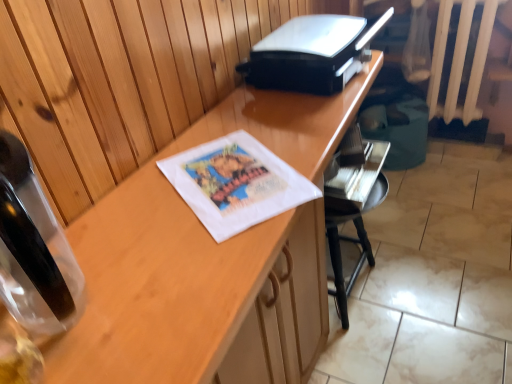
What do you see at coordinates (208, 262) in the screenshot? The width and height of the screenshot is (512, 384). I see `wooden desk at center` at bounding box center [208, 262].

I want to click on wooden desk at center, so click(208, 262).

What do you see at coordinates (312, 53) in the screenshot? The width and height of the screenshot is (512, 384). I see `black plastic printer at upper center` at bounding box center [312, 53].

Locate an element on the screen. The width and height of the screenshot is (512, 384). black plastic printer at upper center is located at coordinates (312, 53).

Locate an element on the screen. wooden desk at center is located at coordinates (208, 262).

Which object is positioned more to the right, black plastic printer at upper center or wooden desk at center?

black plastic printer at upper center.

Is the position of black plastic printer at upper center more distant than that of wooden desk at center?

Yes, it is behind wooden desk at center.

Which is farther from the camera, (294, 22) or (296, 221)?

The point (294, 22) is farther from the camera.

From the image's perspective, which one is positioned higher, black plastic printer at upper center or wooden desk at center?

black plastic printer at upper center, from the image's perspective.

From a real-world perspective, who is located lower, black plastic printer at upper center or wooden desk at center?

In real-world perspective, wooden desk at center is lower.

Which of these two, black plastic printer at upper center or wooden desk at center, is thinner?

Thinner between the two is black plastic printer at upper center.

Who is shorter, black plastic printer at upper center or wooden desk at center?

black plastic printer at upper center.

Based on their sizes in the image, would you say black plastic printer at upper center is bigger or smaller than wooden desk at center?

black plastic printer at upper center is smaller than wooden desk at center.

Is wooden desk at center surrounded by black plastic printer at upper center?

No, wooden desk at center is not surrounded by black plastic printer at upper center.

Is black plastic printer at upper center far away from wooden desk at center?

That's not correct — black plastic printer at upper center is a little close to wooden desk at center.

Is black plastic printer at upper center positioned with its back to wooden desk at center?

No, black plastic printer at upper center is not facing the opposite direction of wooden desk at center.

How different are the orientations of black plastic printer at upper center and wooden desk at center in degrees?

The angle between the facing direction of black plastic printer at upper center and the facing direction of wooden desk at center is 0.71 degrees.

The height and width of the screenshot is (384, 512). Identify the location of printer on the right of wooden desk at center. (312, 53).

Considering the positions of objects wooden desk at center and black plastic printer at upper center in the image provided, who is more to the right, wooden desk at center or black plastic printer at upper center?

From the viewer's perspective, black plastic printer at upper center appears more on the right side.

Based on the photo, in the image, is wooden desk at center positioned in front of or behind black plastic printer at upper center?

wooden desk at center is positioned closer to the viewer than black plastic printer at upper center.

Based on the photo, which is further, (x=146, y=376) or (x=262, y=82)?

The point (x=262, y=82) is farther.

From the image's perspective, is wooden desk at center located beneath black plastic printer at upper center?

Yes, from the image's perspective, wooden desk at center is beneath black plastic printer at upper center.

From a real-world perspective, who is located lower, wooden desk at center or black plastic printer at upper center?

wooden desk at center.

Considering the relative sizes of wooden desk at center and black plastic printer at upper center in the image provided, is wooden desk at center thinner than black plastic printer at upper center?

No, wooden desk at center is not thinner than black plastic printer at upper center.

Which of these two, wooden desk at center or black plastic printer at upper center, stands taller?

wooden desk at center is taller.

Is wooden desk at center bigger than black plastic printer at upper center?

Yes.

Is wooden desk at center spatially inside black plastic printer at upper center, or outside of it?

wooden desk at center exists outside the volume of black plastic printer at upper center.

Would you consider wooden desk at center to be distant from black plastic printer at upper center?

wooden desk at center is actually quite close to black plastic printer at upper center.

Is black plastic printer at upper center at the back of wooden desk at center?

No.

The image size is (512, 384). Find the location of `desk below the black plastic printer at upper center (from the image's perspective)`. desk below the black plastic printer at upper center (from the image's perspective) is located at coordinates (208, 262).

In the image, there is a black plastic printer at upper center. Where is `desk below it (from a real-world perspective)`? The height and width of the screenshot is (384, 512). desk below it (from a real-world perspective) is located at coordinates (208, 262).

Find the location of a particular element. Image resolution: width=512 pixels, height=384 pixels. printer lying behind the wooden desk at center is located at coordinates (312, 53).